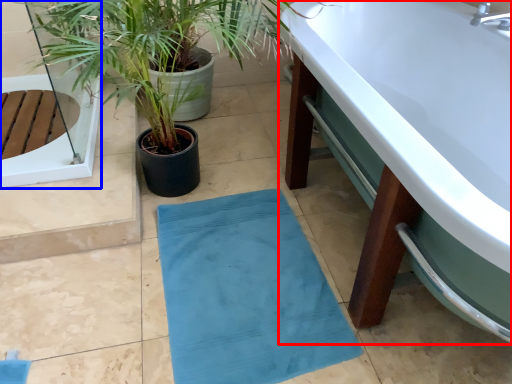
Question: Which object is further to the camera taking this photo, bathtub (highlighted by a red box) or glass door (highlighted by a blue box)?

Choices:
 (A) bathtub
 (B) glass door

Answer: (B)